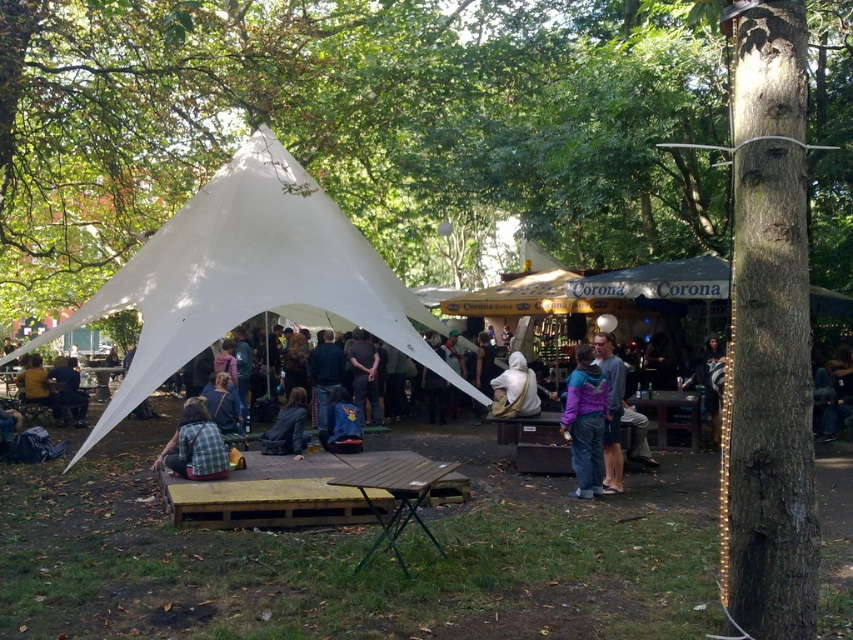
Question: Estimate the real-world distances between objects in this image. Which object is farther from the white fabric tent at left?

Choices:
 (A) plaid fabric shirt at center
 (B) blue fabric bag at center
 (C) plaid fabric shirt at lower left
 (D) white fabric bag at center

Answer: (D)

Question: Can you confirm if gray sweater at center is bigger than leather jacket at center?

Choices:
 (A) yes
 (B) no

Answer: (A)

Question: Does purple fleece jacket at center appear over plaid fabric shirt at center?

Choices:
 (A) yes
 (B) no

Answer: (A)

Question: Is gray sweater at center above plaid fabric shirt at center?

Choices:
 (A) no
 (B) yes

Answer: (B)

Question: Which object is the closest to the plaid fabric shirt at center?

Choices:
 (A) gray sweater at center
 (B) purple fleece jacket at center
 (C) plaid fabric shirt at lower left
 (D) white fabric bag at center

Answer: (C)

Question: Estimate the real-world distances between objects in this image. Which object is farther from the purple fleece jacket at center?

Choices:
 (A) plaid fabric shirt at center
 (B) blue fabric bag at center
 (C) wooden picnic table at center

Answer: (A)